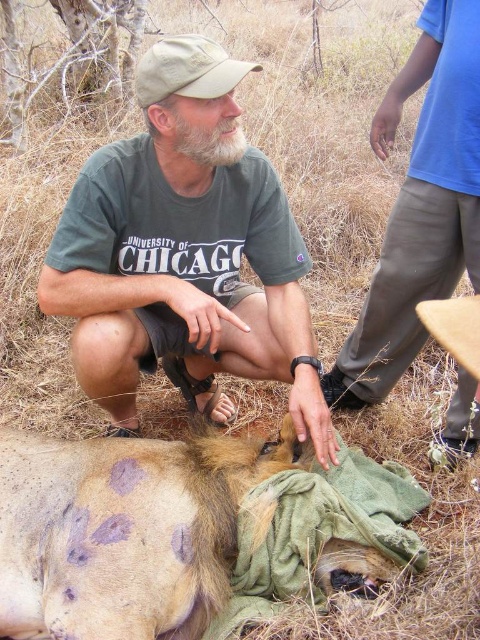
Who is more distant from viewer, (215, 60) or (173, 580)?

Point (215, 60)

Is point (163, 90) positioned before point (180, 627)?

No, (163, 90) is further to viewer.

Where is `green cotton t-shirt at center`? Image resolution: width=480 pixels, height=640 pixels. green cotton t-shirt at center is located at coordinates (184, 252).

What are the coordinates of `green cotton t-shirt at center` in the screenshot? It's located at (184, 252).

Is blue cotton shirt at upper right smaller than green soft cloth at lower center?

No, blue cotton shirt at upper right is not smaller than green soft cloth at lower center.

Does blue cotton shirt at upper right have a greater height compared to green soft cloth at lower center?

Indeed, blue cotton shirt at upper right has a greater height compared to green soft cloth at lower center.

What do you see at coordinates (420, 205) in the screenshot? I see `blue cotton shirt at upper right` at bounding box center [420, 205].

The image size is (480, 640). Identify the location of blue cotton shirt at upper right. (x=420, y=205).

Locate an element on the screen. The height and width of the screenshot is (640, 480). green cotton t-shirt at center is located at coordinates (184, 252).

Is point (215, 170) farther from viewer compared to point (398, 477)?

No.

In order to click on green cotton t-shirt at center in this screenshot , I will do `click(184, 252)`.